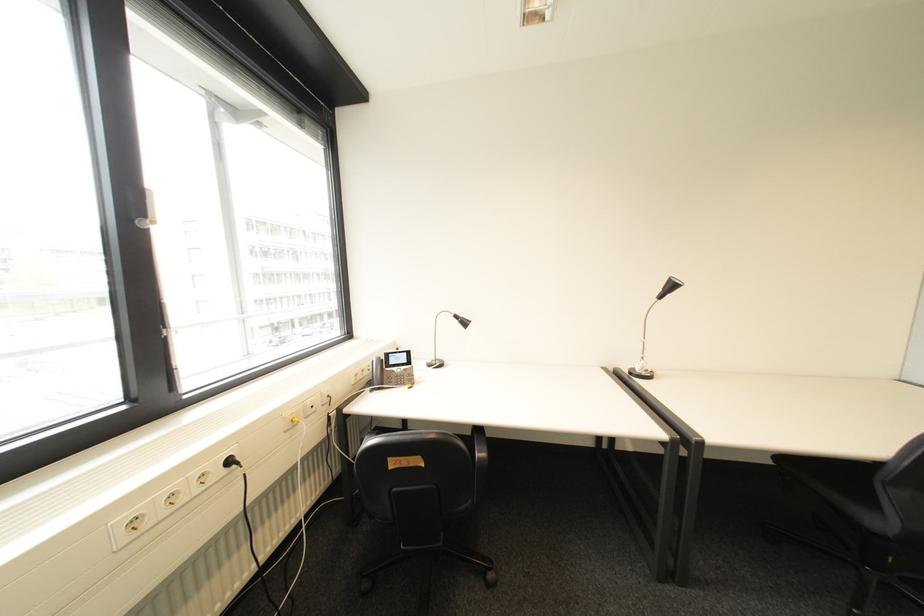
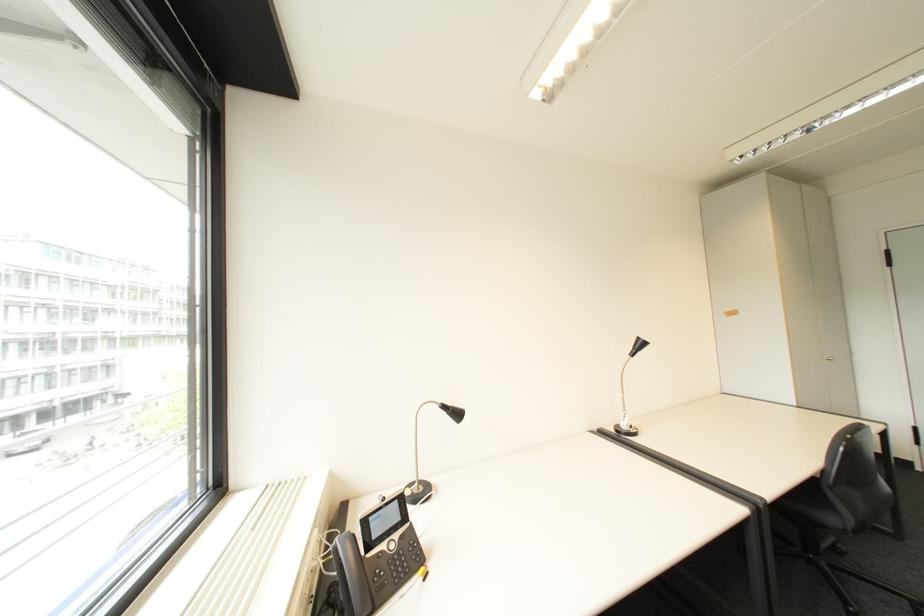
Locate, in the second image, the point that corresponds to the point at 467,317 in the first image.

(455, 407)